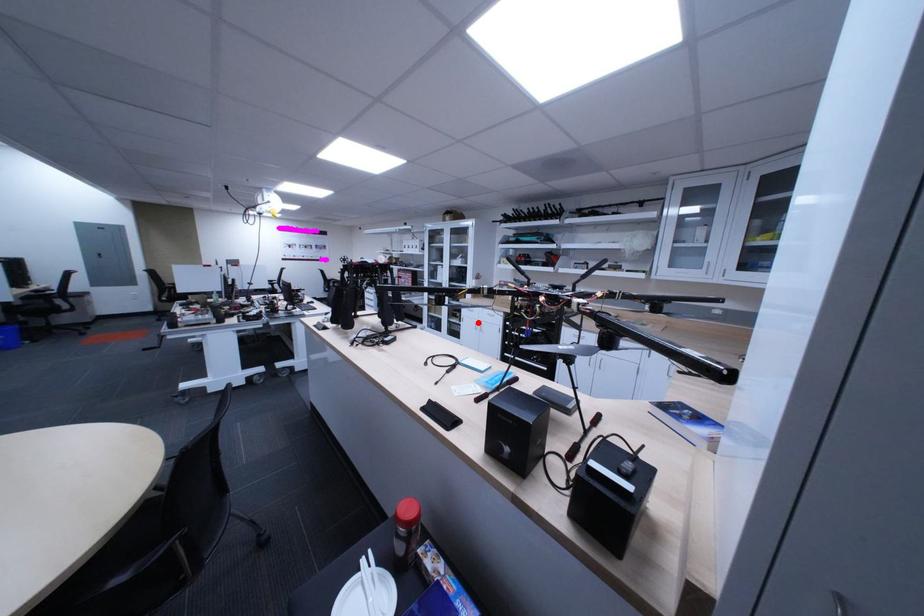
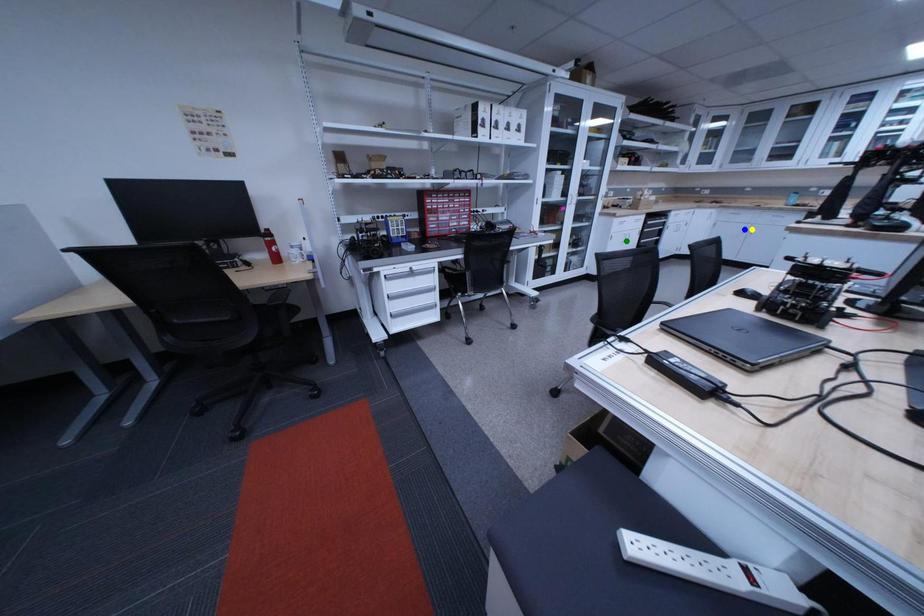
Question: I am providing you with two images of the same scene from different viewpoints. A red point is marked on the first image. You are given multiple points on the second image. In image 2, which mark is for the same physical point as the one in image 1?

Choices:
 (A) yellow point
 (B) green point
 (C) blue point

Answer: (B)